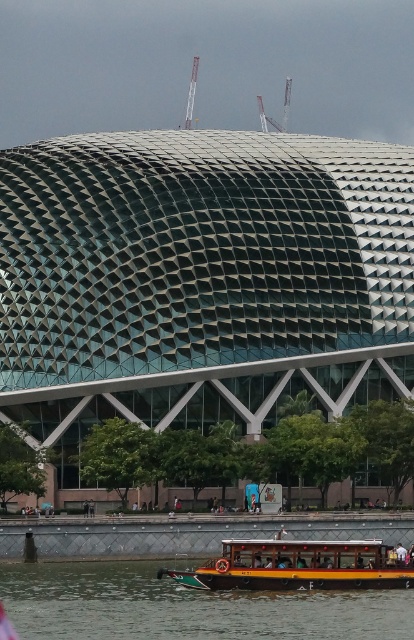
You are a tour guide who needs to board both the green wooden boat at lower center and the wooden polished boat at lower center. The minimum distance required between the two boats for safe boarding is 4 meters. Can you safely board both boats as they are currently positioned?

The green wooden boat at lower center and the wooden polished boat at lower center are 3.82 meters apart from each other, which is less than the required 4 meters for safe boarding. Therefore, boarding both boats as they are currently positioned may not be safe due to insufficient distance between them.